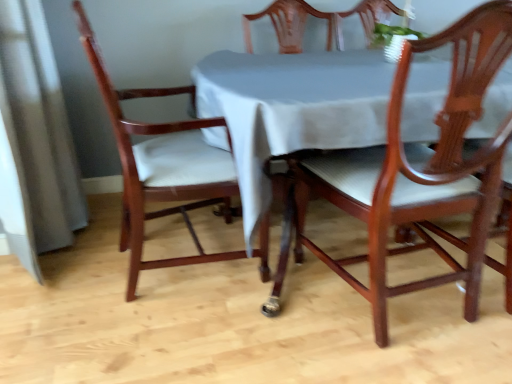
Question: Which direction should I rotate to look at mahogany wood chair at center, the 2th chair when ordered from left to right?

Choices:
 (A) right
 (B) left

Answer: (A)

Question: From a real-world perspective, is mahogany wood chair at center, the 2th chair when ordered from left to right, positioned under mahogany wood chair at left, which is counted as the 1th chair, starting from the left, based on gravity?

Choices:
 (A) no
 (B) yes

Answer: (A)

Question: Does mahogany wood chair at center, acting as the 1th chair starting from the right, turn towards mahogany wood chair at left, which is the second chair in right-to-left order?

Choices:
 (A) yes
 (B) no

Answer: (B)

Question: From the image's perspective, does mahogany wood chair at center, acting as the 1th chair starting from the right, appear higher than mahogany wood chair at left, which is the second chair in right-to-left order?

Choices:
 (A) no
 (B) yes

Answer: (A)

Question: Is mahogany wood chair at center, acting as the 1th chair starting from the right, positioned beyond the bounds of mahogany wood chair at left, which is counted as the 1th chair, starting from the left?

Choices:
 (A) yes
 (B) no

Answer: (A)

Question: Can you see mahogany wood chair at center, acting as the 1th chair starting from the right, touching mahogany wood chair at left, which is the second chair in right-to-left order?

Choices:
 (A) yes
 (B) no

Answer: (B)

Question: Would you say mahogany wood chair at left, which is the second chair in right-to-left order, is part of mahogany wood chair at center, acting as the 1th chair starting from the right,'s contents?

Choices:
 (A) yes
 (B) no

Answer: (B)

Question: Does mahogany wood chair at left, which is the second chair in right-to-left order, come behind mahogany wood chair at center, the 2th chair when ordered from left to right?

Choices:
 (A) no
 (B) yes

Answer: (B)

Question: Are mahogany wood chair at left, which is counted as the 1th chair, starting from the left, and mahogany wood chair at center, acting as the 1th chair starting from the right, beside each other?

Choices:
 (A) yes
 (B) no

Answer: (B)

Question: From a real-world perspective, is mahogany wood chair at left, which is counted as the 1th chair, starting from the left, under mahogany wood chair at center, acting as the 1th chair starting from the right?

Choices:
 (A) no
 (B) yes

Answer: (B)

Question: Does mahogany wood chair at left, which is counted as the 1th chair, starting from the left, have a larger size compared to mahogany wood chair at center, the 2th chair when ordered from left to right?

Choices:
 (A) yes
 (B) no

Answer: (A)

Question: Is mahogany wood chair at left, which is counted as the 1th chair, starting from the left, smaller than mahogany wood chair at center, the 2th chair when ordered from left to right?

Choices:
 (A) yes
 (B) no

Answer: (B)

Question: Can you confirm if mahogany wood chair at left, which is the second chair in right-to-left order, is positioned to the left of mahogany wood chair at center, the 2th chair when ordered from left to right?

Choices:
 (A) yes
 (B) no

Answer: (A)

Question: In terms of width, does mahogany wood chair at left, which is counted as the 1th chair, starting from the left, look wider or thinner when compared to mahogany wood chair at center, acting as the 1th chair starting from the right?

Choices:
 (A) thin
 (B) wide

Answer: (B)